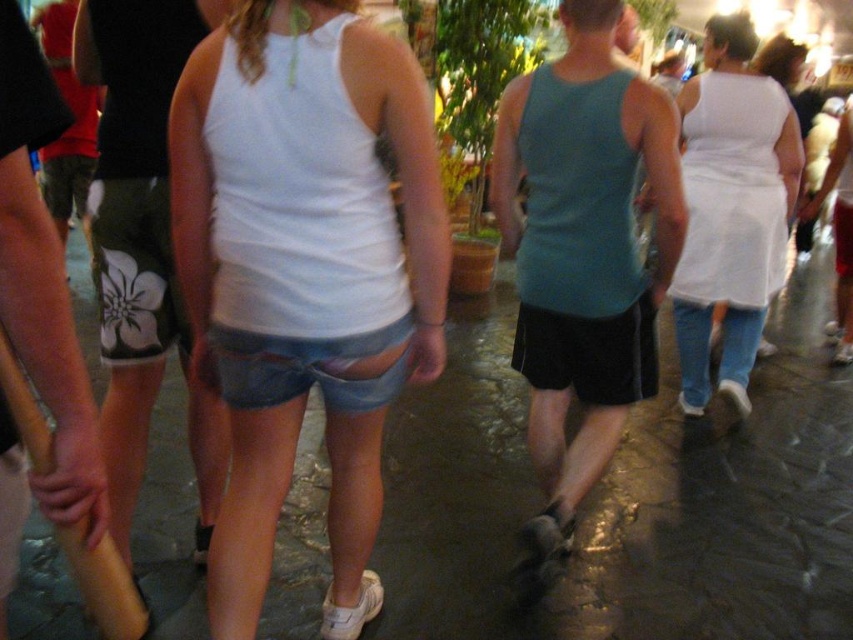
Which is below, white matte tank top at center or white cotton dress at upper right?

white matte tank top at center is lower down.

Does white matte tank top at center appear under white cotton dress at upper right?

Indeed, white matte tank top at center is positioned under white cotton dress at upper right.

What do you see at coordinates (305, 273) in the screenshot?
I see `white matte tank top at center` at bounding box center [305, 273].

Where is `white matte tank top at center`? white matte tank top at center is located at coordinates (305, 273).

Looking at this image, is white matte tank top at center positioned in front of teal fabric shorts at center?

Yes, it is in front of teal fabric shorts at center.

Is point (438, 353) behind point (543, 179)?

No, it is not.

Locate an element on the screen. white matte tank top at center is located at coordinates (305, 273).

Is teal fabric shorts at center bigger than white cotton dress at upper right?

No.

Does teal fabric shorts at center appear under white cotton dress at upper right?

Yes, teal fabric shorts at center is below white cotton dress at upper right.

Is point (654, 312) positioned in front of point (743, 396)?

Yes, it is.

Where is `teal fabric shorts at center`? Image resolution: width=853 pixels, height=640 pixels. teal fabric shorts at center is located at coordinates tap(583, 248).